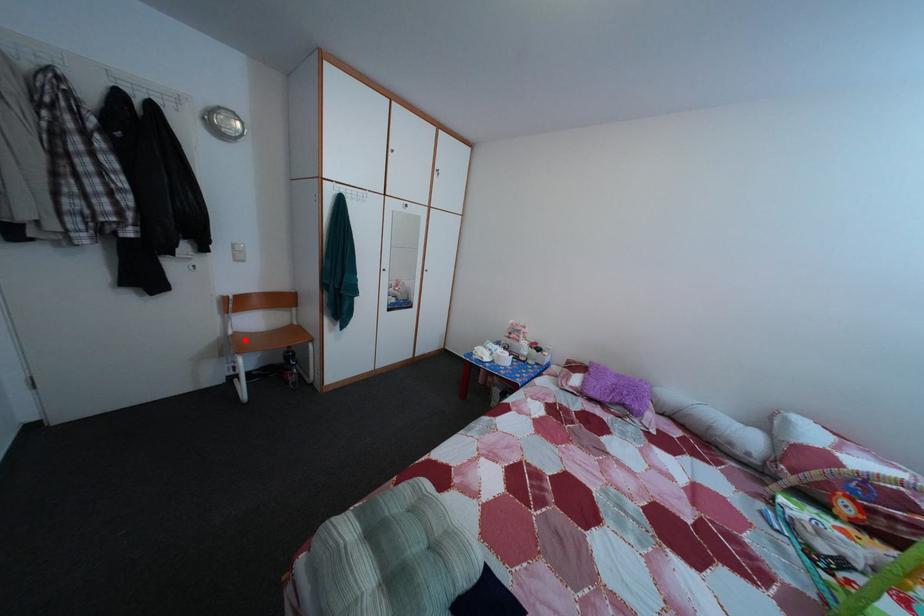
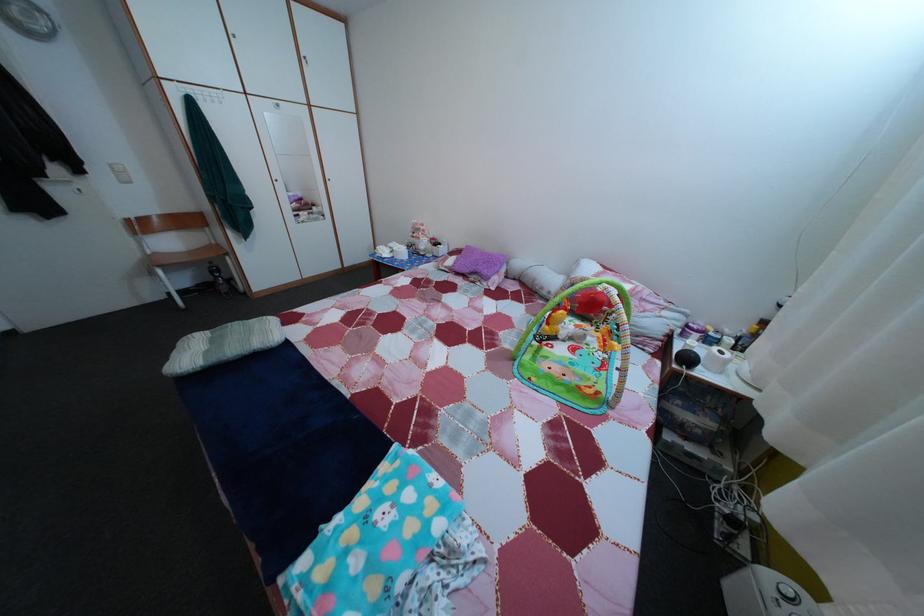
Question: I am providing you with two images of the same scene from different viewpoints. A red point is marked on the first image. Is the red point's position out of view in image 2?

Choices:
 (A) Yes
 (B) No

Answer: (B)